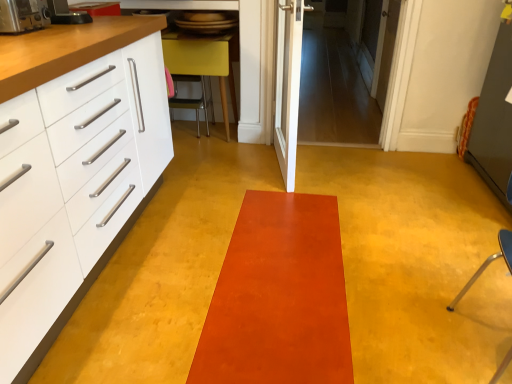
Where is `vacant area on top of satin orange mat at center (from a real-world perspective)`? vacant area on top of satin orange mat at center (from a real-world perspective) is located at coordinates (278, 262).